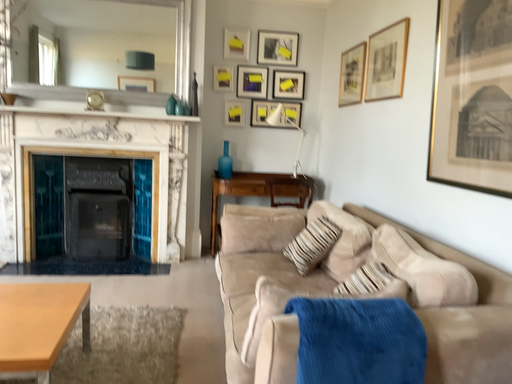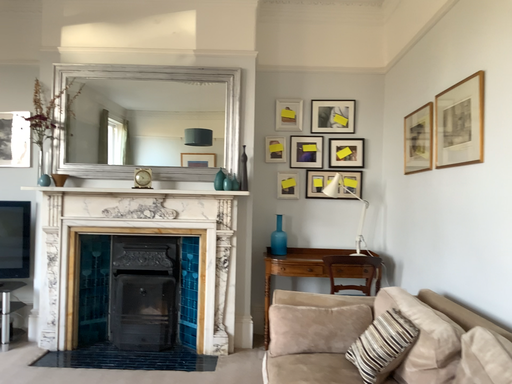
Question: Which way did the camera rotate in the video?

Choices:
 (A) rotated left
 (B) rotated right

Answer: (A)